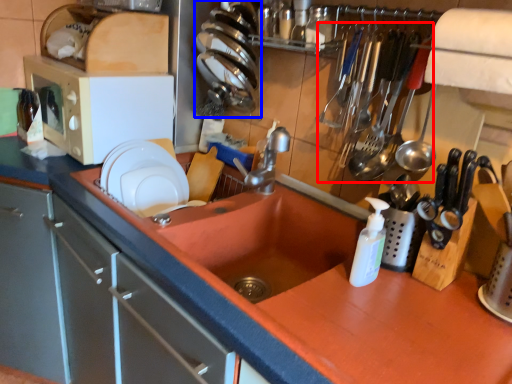
Question: Which object appears farthest to the camera in this image, silverware (highlighted by a red box) or tableware (highlighted by a blue box)?

Choices:
 (A) silverware
 (B) tableware

Answer: (B)